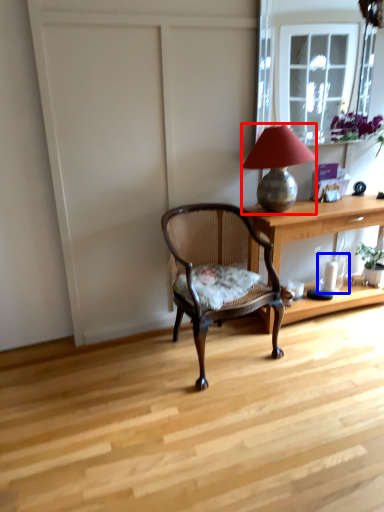
Question: Among these objects, which one is farthest to the camera, lamp (highlighted by a red box) or glass vase (highlighted by a blue box)?

Choices:
 (A) lamp
 (B) glass vase

Answer: (B)